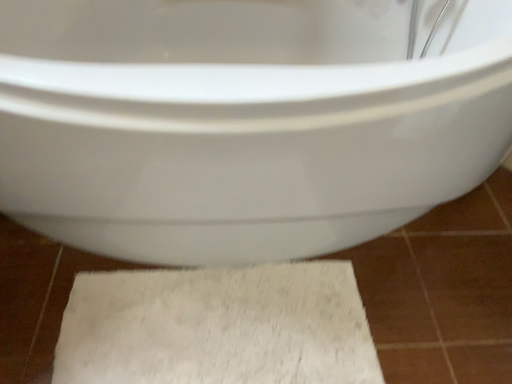
What are the coordinates of `vacant area that lies to the right of white fluffy bath mat at lower center` in the screenshot? It's located at (426, 288).